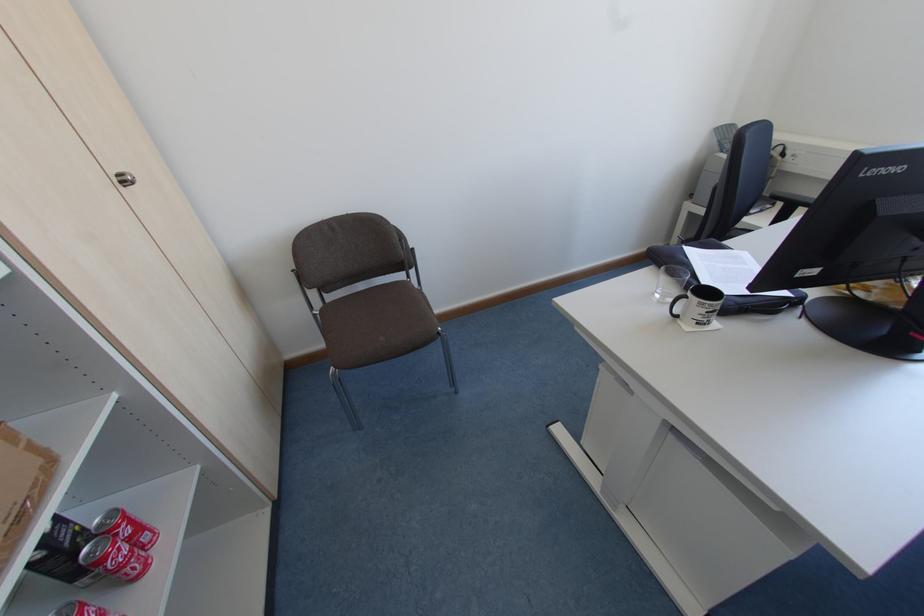
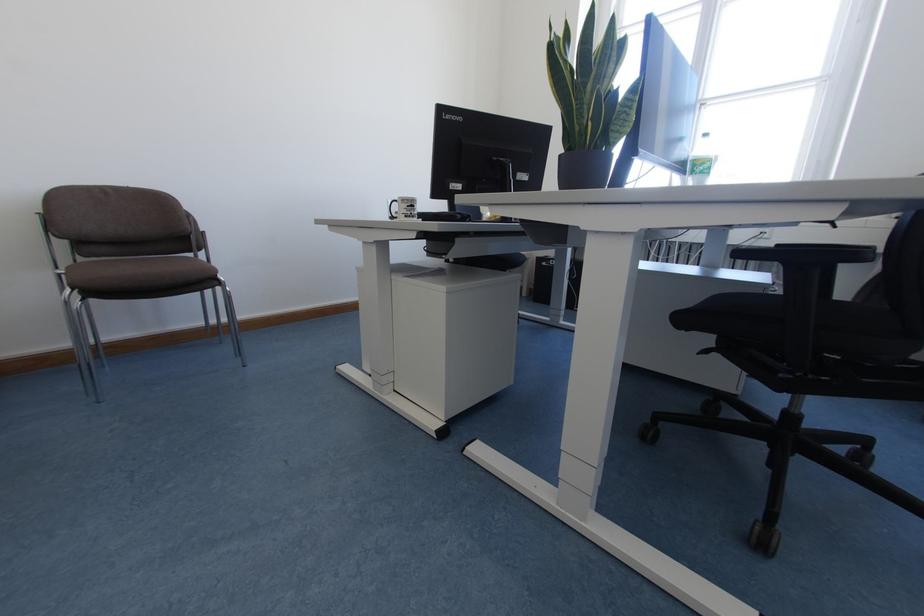
The point at (697, 323) is marked in the first image. Where is the corresponding point in the second image?

(405, 216)